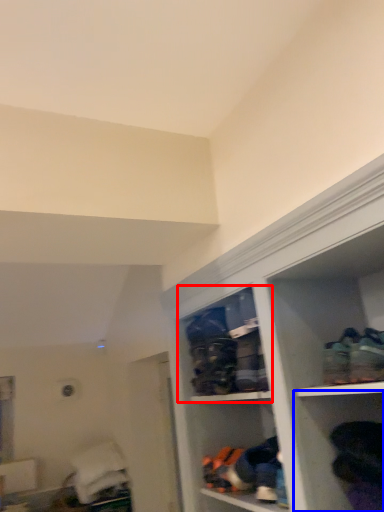
Question: Which of the following is the closest to the observer, cabinet (highlighted by a red box) or shelf (highlighted by a blue box)?

Choices:
 (A) cabinet
 (B) shelf

Answer: (B)